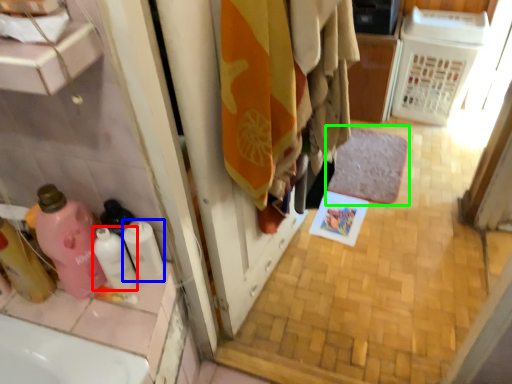
Question: Which is nearer to the cleaning product (highlighted by a red box)? toilet paper (highlighted by a blue box) or bath mat (highlighted by a green box).

Choices:
 (A) toilet paper
 (B) bath mat

Answer: (A)